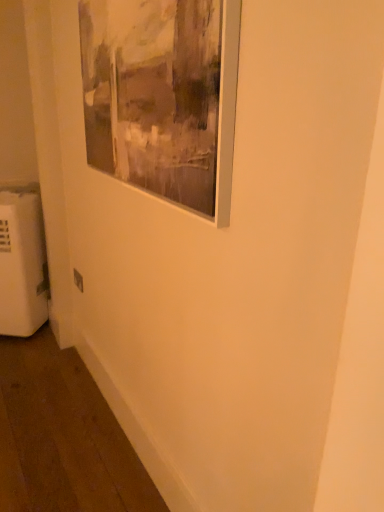
Question: Is white plastic electric outlet at lower left taller or shorter than white plastic radiator at lower left?

Choices:
 (A) tall
 (B) short

Answer: (B)

Question: Is white plastic electric outlet at lower left wider or thinner than white plastic radiator at lower left?

Choices:
 (A) wide
 (B) thin

Answer: (B)

Question: Considering the real-world distances, which object is closest to the white plastic radiator at lower left?

Choices:
 (A) matte silver picture frame at upper left
 (B) white plastic electric outlet at lower left

Answer: (B)

Question: Based on their relative distances, which object is nearer to the matte silver picture frame at upper left?

Choices:
 (A) white plastic electric outlet at lower left
 (B) white plastic radiator at lower left

Answer: (A)